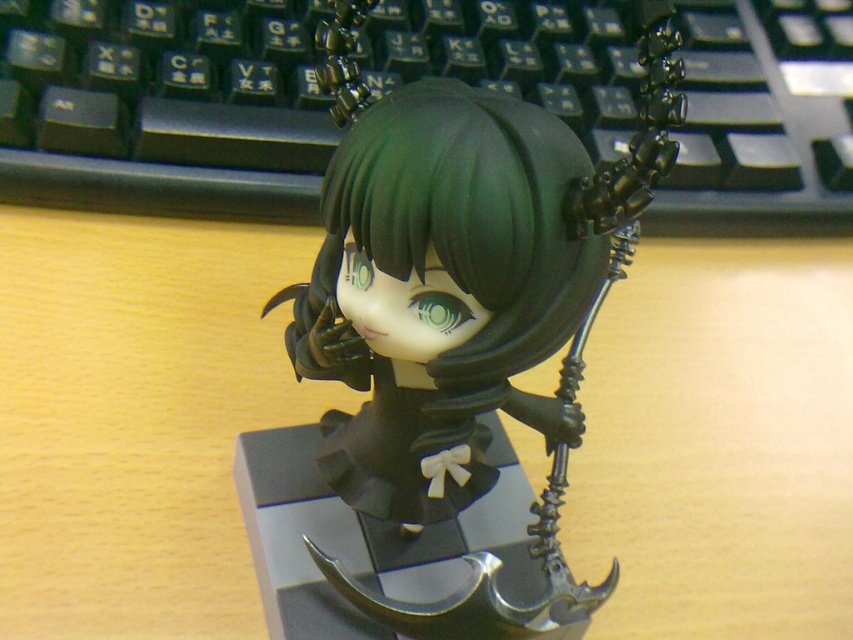
You are organizing a desk and need to place a mouse between the black plastic keyboard at upper center and the matte black figurine at center. Can the mouse fit between them if it requires 10 inches of space?

The black plastic keyboard at upper center is 20.36 inches away from the matte black figurine at center, so yes, the mouse can fit between them as there is sufficient space.

You are trying to place a small sticker on your desk, but you want it to be near the figurine. The sticker is 1 cm in diameter. The point marked as point (x=163, y=106) is on the black plastic keyboard at upper center. Can you place the sticker near the figurine without it overlapping the keyboard?

The point marked as point (x=163, y=106) is on the black plastic keyboard at upper center. Since the sticker is 1 cm in diameter and the keyboard is part of the desk background, placing it near the figurine but not overlapping the keyboard would require positioning it away from that point. However, the exact placement depends on the desk layout not detailed here.

You are organizing your desk and want to move the matte black figurine at center closer to the edge so you can access it easily. However, there is a black plastic keyboard at upper center in the way. Can you slide the figurine forward past the keyboard without moving the keyboard?

The matte black figurine at center is behind the black plastic keyboard at upper center, so you can slide the figurine forward past the keyboard without moving it since it is currently positioned behind.